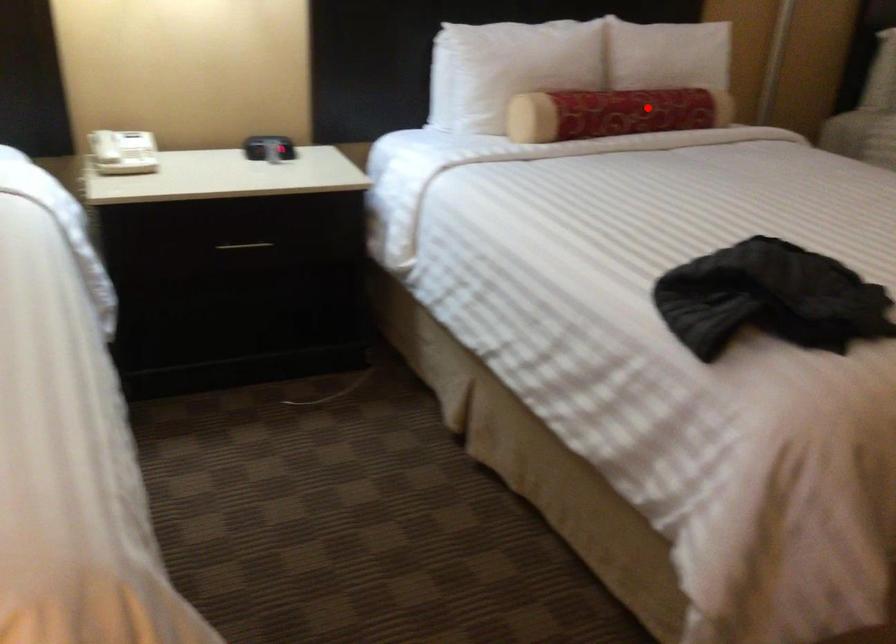
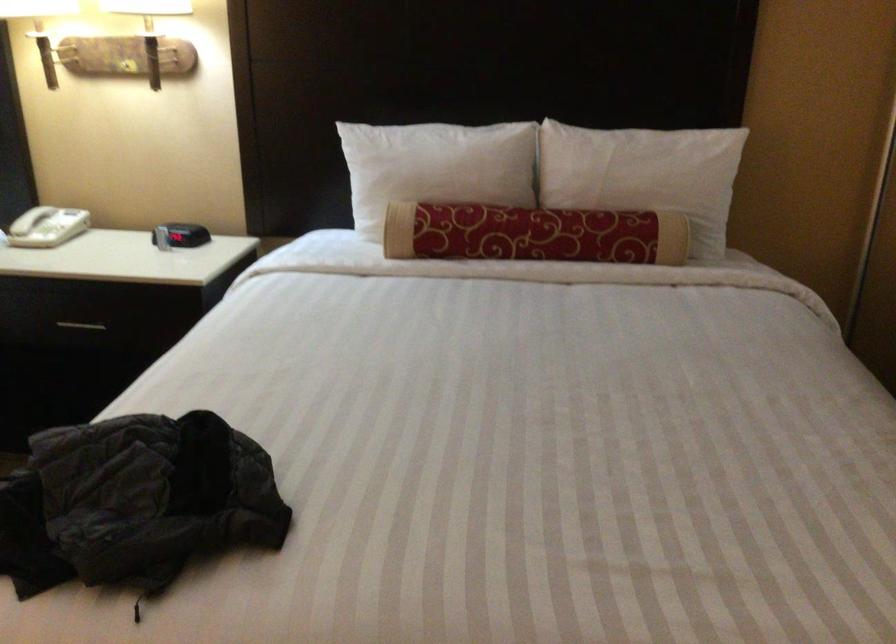
Question: I am providing you with two images of the same scene from different viewpoints. A red point is shown in image1. For the corresponding object point in image2, is it positioned nearer or farther from the camera?

Choices:
 (A) Nearer
 (B) Farther

Answer: (A)